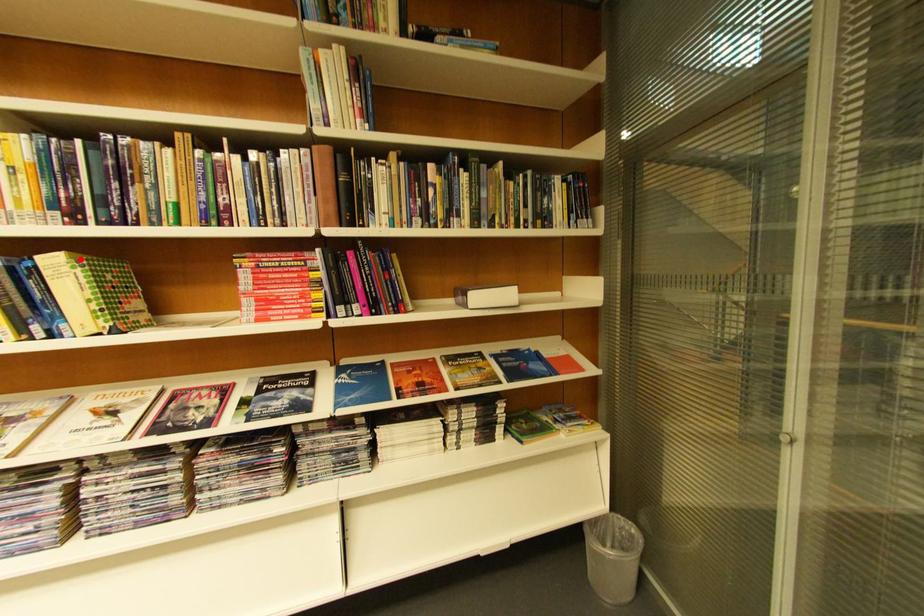
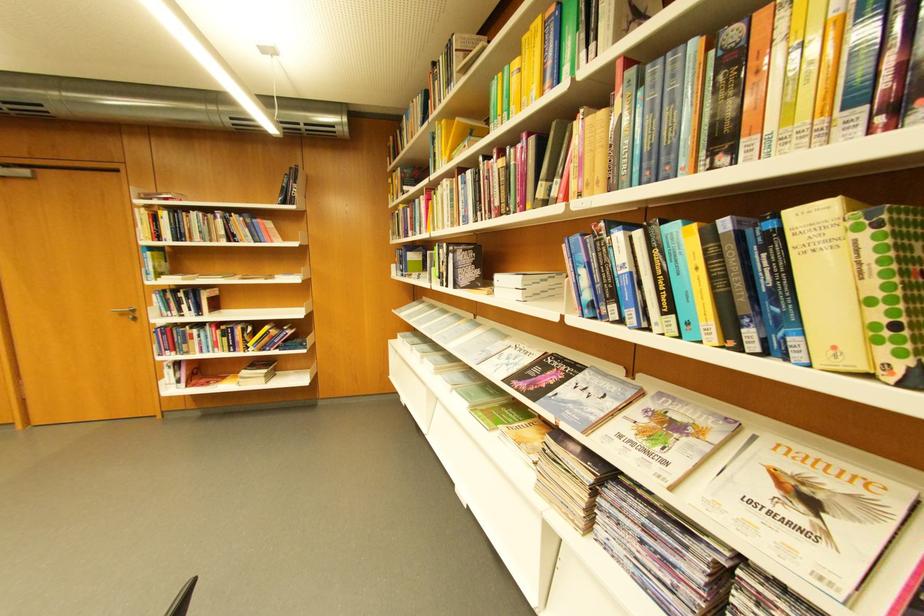
Find the pixel in the second image that matches the highlighted location in the first image.

(861, 209)